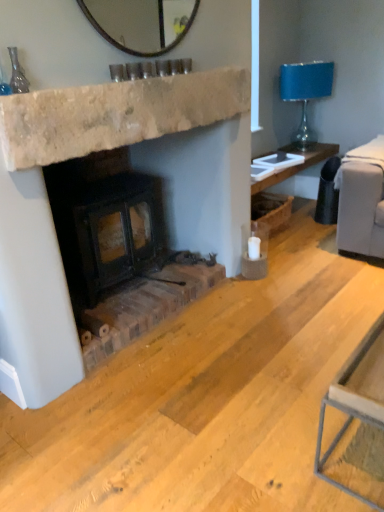
Question: Is rustic brick wood burning stove at center smaller than natural stone fireplace at center?

Choices:
 (A) no
 (B) yes

Answer: (A)

Question: Is rustic brick wood burning stove at center beside natural stone fireplace at center?

Choices:
 (A) yes
 (B) no

Answer: (B)

Question: Is natural stone fireplace at center located within rustic brick wood burning stove at center?

Choices:
 (A) yes
 (B) no

Answer: (B)

Question: Is rustic brick wood burning stove at center at the right side of natural stone fireplace at center?

Choices:
 (A) yes
 (B) no

Answer: (B)

Question: From the image's perspective, is rustic brick wood burning stove at center above natural stone fireplace at center?

Choices:
 (A) yes
 (B) no

Answer: (B)

Question: Is blue glass lampshade at upper right taller or shorter than rustic brick wood burning stove at center?

Choices:
 (A) short
 (B) tall

Answer: (B)

Question: Is point (297, 93) closer or farther from the camera than point (145, 198)?

Choices:
 (A) closer
 (B) farther

Answer: (B)

Question: Is blue glass lampshade at upper right in front of or behind rustic brick wood burning stove at center in the image?

Choices:
 (A) behind
 (B) front

Answer: (A)

Question: In the image, is blue glass lampshade at upper right on the left side or the right side of rustic brick wood burning stove at center?

Choices:
 (A) left
 (B) right

Answer: (B)

Question: Considering their positions, is rustic brick wood burning stove at center located in front of or behind natural stone fireplace at center?

Choices:
 (A) front
 (B) behind

Answer: (B)

Question: Does point (82, 204) appear closer or farther from the camera than point (236, 70)?

Choices:
 (A) farther
 (B) closer

Answer: (B)

Question: Which is correct: rustic brick wood burning stove at center is inside natural stone fireplace at center, or outside of it?

Choices:
 (A) outside
 (B) inside

Answer: (A)

Question: In terms of height, does rustic brick wood burning stove at center look taller or shorter compared to natural stone fireplace at center?

Choices:
 (A) short
 (B) tall

Answer: (A)

Question: In terms of height, does rustic brick wood burning stove at center look taller or shorter compared to blue glass lampshade at upper right?

Choices:
 (A) short
 (B) tall

Answer: (A)

Question: Is rustic brick wood burning stove at center bigger or smaller than blue glass lampshade at upper right?

Choices:
 (A) big
 (B) small

Answer: (B)